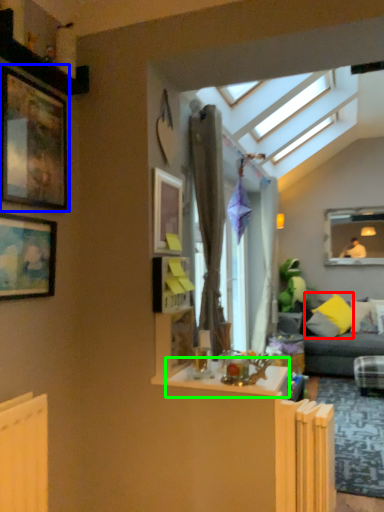
Question: Based on their relative distances, which object is farther from pillow (highlighted by a red box)? Choose from picture frame (highlighted by a blue box) and table (highlighted by a green box).

Choices:
 (A) picture frame
 (B) table

Answer: (A)